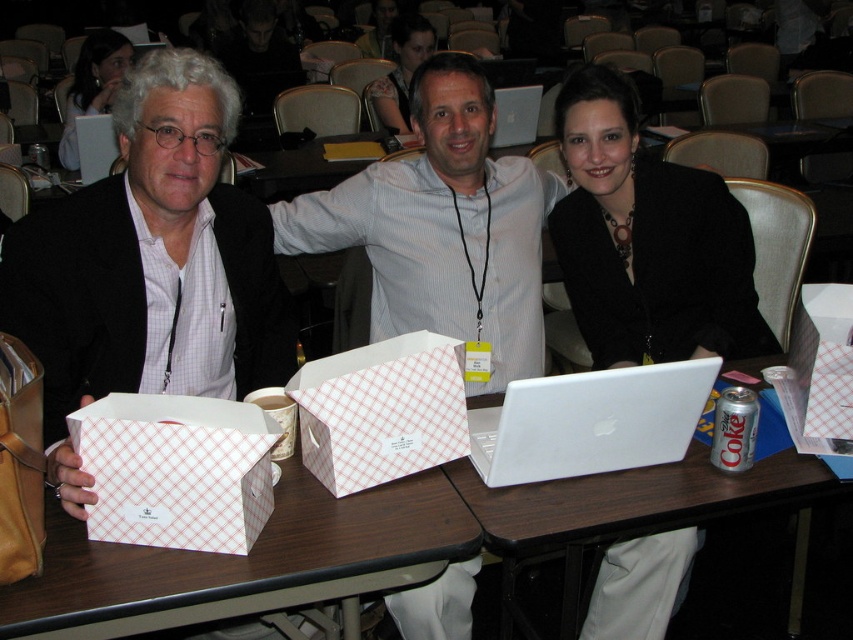
Question: Which of the following is the farthest from the observer?

Choices:
 (A) (519, 493)
 (B) (67, 588)
 (C) (383, 84)

Answer: (C)

Question: Where is white checkered box at center located in relation to matte black jacket at upper left in the image?

Choices:
 (A) above
 (B) below

Answer: (B)

Question: Does matte white box at left come behind white matte laptop at center?

Choices:
 (A) no
 (B) yes

Answer: (A)

Question: Which object is closer to the camera taking this photo?

Choices:
 (A) white paper bag at center
 (B) black fabric jacket at center
 (C) white checkered box at center
 (D) white matte laptop at center

Answer: (A)

Question: Is white paper bag at center bigger than matte black jacket at upper center?

Choices:
 (A) yes
 (B) no

Answer: (B)

Question: Which point is closer to the camera?

Choices:
 (A) (531, 92)
 (B) (78, 88)

Answer: (A)